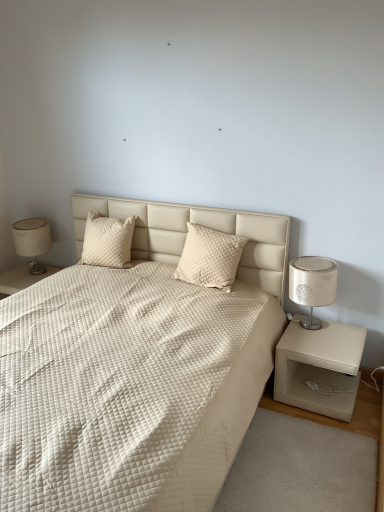
Question: In terms of width, does white leather nightstand at lower left, marked as the 2th nightstand in a front-to-back arrangement, look wider or thinner when compared to white quilted fabric bed at center?

Choices:
 (A) thin
 (B) wide

Answer: (A)

Question: Would you say white leather nightstand at lower left, placed as the 1th nightstand when sorted from top to bottom, is to the left or to the right of white quilted fabric bed at center in the picture?

Choices:
 (A) right
 (B) left

Answer: (B)

Question: Which of these objects is positioned farthest from the cream quilted pillow at center, which is counted as the 2th pillow, starting from the left?

Choices:
 (A) quilted cream pillow at upper left, which is the second pillow in right-to-left order
 (B) white quilted fabric bed at center
 (C) matte beige lampshade at left
 (D) white leather nightstand at lower left, the 2th nightstand in the right-to-left sequence
 (E) white textured lamp at right

Answer: (D)

Question: Based on their relative distances, which object is farther from the matte beige lampshade at left?

Choices:
 (A) beige leather nightstand at right, which is the 1th nightstand from front to back
 (B) quilted cream pillow at upper left, the 1th pillow viewed from the left
 (C) white quilted fabric bed at center
 (D) white leather nightstand at lower left, marked as the 2th nightstand in a front-to-back arrangement
 (E) white textured lamp at right

Answer: (A)